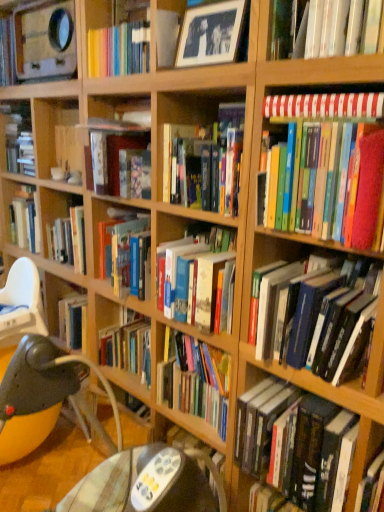
Question: Is hardcover books at center surrounding hardcover book at center, the 7th book positioned from the top?

Choices:
 (A) no
 (B) yes

Answer: (A)

Question: Is hardcover books at center further to camera compared to hardcover book at center, the 7th book positioned from the top?

Choices:
 (A) yes
 (B) no

Answer: (A)

Question: Does hardcover books at center appear on the right side of hardcover book at center, the 7th book positioned from the top?

Choices:
 (A) no
 (B) yes

Answer: (A)

Question: From the image's perspective, would you say hardcover books at center is positioned over hardcover book at center, the 7th book positioned from the top?

Choices:
 (A) no
 (B) yes

Answer: (B)

Question: Is hardcover books at center taller than hardcover book at center, which appears as the first book when ordered from the bottom?

Choices:
 (A) no
 (B) yes

Answer: (B)

Question: Does hardcover books at center have a greater width compared to hardcover book at center, which appears as the first book when ordered from the bottom?

Choices:
 (A) no
 (B) yes

Answer: (A)

Question: Is the surface of hardcover book at upper right, which ranks as the second book in top-to-bottom order, in direct contact with hardcover books at center?

Choices:
 (A) no
 (B) yes

Answer: (A)

Question: Is hardcover book at upper right, which ranks as the second book in top-to-bottom order, looking in the opposite direction of hardcover books at center?

Choices:
 (A) yes
 (B) no

Answer: (B)

Question: Does hardcover book at upper right, which ranks as the second book in top-to-bottom order, have a smaller size compared to hardcover books at center?

Choices:
 (A) yes
 (B) no

Answer: (A)

Question: Is hardcover books at center a part of hardcover book at upper right, which ranks as the second book in top-to-bottom order?

Choices:
 (A) no
 (B) yes

Answer: (A)

Question: Considering the relative positions of hardcover book at upper right, which appears as the 6th book when ordered from the bottom, and hardcover books at center in the image provided, is hardcover book at upper right, which appears as the 6th book when ordered from the bottom, to the right of hardcover books at center from the viewer's perspective?

Choices:
 (A) no
 (B) yes

Answer: (B)

Question: From the image's perspective, does hardcover book at upper right, which ranks as the second book in top-to-bottom order, appear higher than hardcover books at center?

Choices:
 (A) yes
 (B) no

Answer: (A)

Question: Is plastic highchair at lower left thinner than hardcover books at right, which is counted as the sixth book, starting from the top?

Choices:
 (A) no
 (B) yes

Answer: (B)